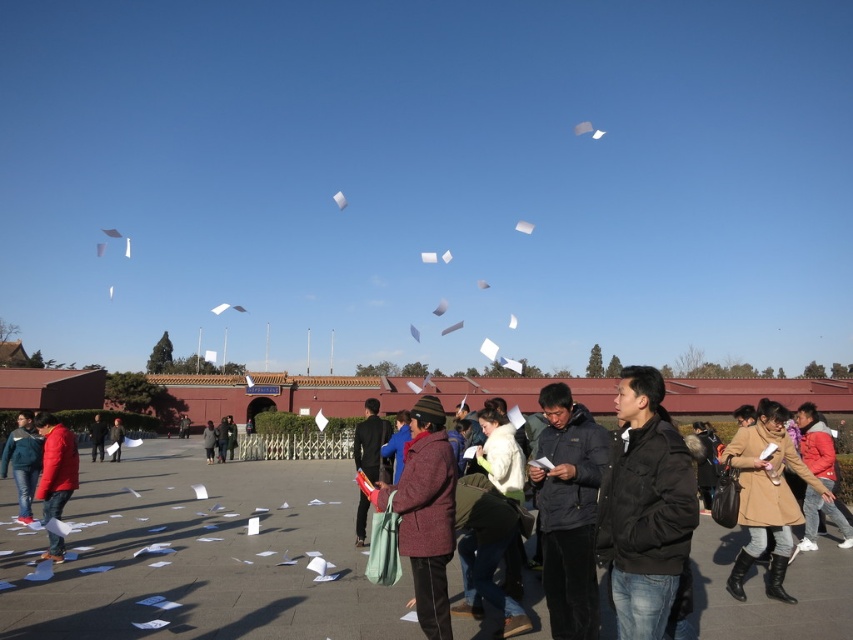
Does matte blue jacket at lower left have a lesser width compared to dark brown leather jacket at center?

No.

Based on the photo, does matte blue jacket at lower left appear on the left side of dark brown leather jacket at center?

No, matte blue jacket at lower left is not to the left of dark brown leather jacket at center.

Which is in front, point (27, 468) or point (117, 444)?

Point (27, 468) is in front.

This screenshot has width=853, height=640. In order to click on matte blue jacket at lower left in this screenshot , I will do `click(22, 461)`.

Between point (51, 416) and point (207, 454), which one is positioned behind?

The point (207, 454) is behind.

From the picture: Between matte red jacket at lower left and dark gray jacket at center, which one is positioned higher?

Positioned higher is matte red jacket at lower left.

Is point (57, 481) farther from viewer compared to point (213, 442)?

No, (57, 481) is closer to viewer.

You are a GUI agent. You are given a task and a screenshot of the screen. Output one action in this format:
    pyautogui.click(x=<x>, y=<y>)
    Task: Click on the matte red jacket at lower left
    Image resolution: width=853 pixels, height=640 pixels.
    Given the screenshot: What is the action you would take?
    pyautogui.click(x=55, y=465)

Can you confirm if matte blue jacket at lower left is positioned above black matte jacket at center?

Correct, matte blue jacket at lower left is located above black matte jacket at center.

Is matte blue jacket at lower left thinner than black matte jacket at center?

No, matte blue jacket at lower left is not thinner than black matte jacket at center.

Locate an element on the screen. matte blue jacket at lower left is located at coordinates (22, 461).

The image size is (853, 640). Identify the location of matte blue jacket at lower left. (22, 461).